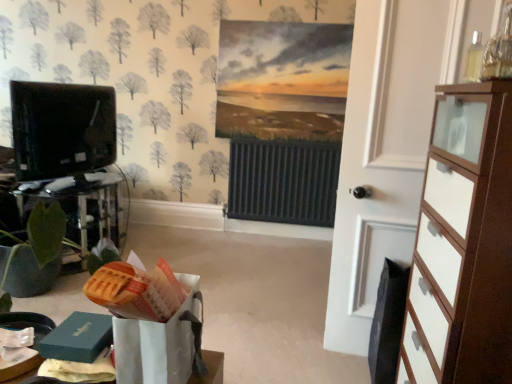
Question: Could you tell me if black glossy tv at left is facing white wood door at right?

Choices:
 (A) yes
 (B) no

Answer: (B)

Question: Considering the relative sizes of black glossy tv at left and white wood door at right in the image provided, is black glossy tv at left taller than white wood door at right?

Choices:
 (A) no
 (B) yes

Answer: (A)

Question: From the image's perspective, does black glossy tv at left appear lower than white wood door at right?

Choices:
 (A) yes
 (B) no

Answer: (B)

Question: Is black glossy tv at left positioned behind white wood door at right?

Choices:
 (A) no
 (B) yes

Answer: (B)

Question: From the image's perspective, is black glossy tv at left over white wood door at right?

Choices:
 (A) yes
 (B) no

Answer: (A)

Question: From a real-world perspective, is black glossy tv at left physically below white wood door at right?

Choices:
 (A) yes
 (B) no

Answer: (B)

Question: Considering the relative positions of white glossy chest of drawers at right and white wood door at right in the image provided, is white glossy chest of drawers at right to the right of white wood door at right from the viewer's perspective?

Choices:
 (A) no
 (B) yes

Answer: (B)

Question: From a real-world perspective, is white glossy chest of drawers at right physically above white wood door at right?

Choices:
 (A) no
 (B) yes

Answer: (A)

Question: Is white wood door at right inside white glossy chest of drawers at right?

Choices:
 (A) yes
 (B) no

Answer: (B)

Question: Is white glossy chest of drawers at right bigger than white wood door at right?

Choices:
 (A) no
 (B) yes

Answer: (B)

Question: Is white glossy chest of drawers at right positioned before white wood door at right?

Choices:
 (A) yes
 (B) no

Answer: (A)

Question: Would you say white glossy chest of drawers at right is a long distance from white wood door at right?

Choices:
 (A) no
 (B) yes

Answer: (A)

Question: Is white glossy chest of drawers at right inside white wood door at right?

Choices:
 (A) yes
 (B) no

Answer: (B)